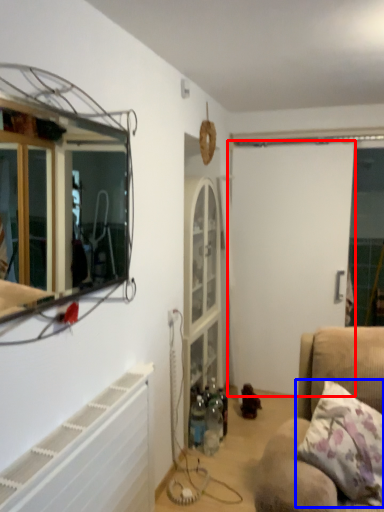
Question: Which point is further to the camera, screen door (highlighted by a red box) or pillow (highlighted by a blue box)?

Choices:
 (A) screen door
 (B) pillow

Answer: (A)